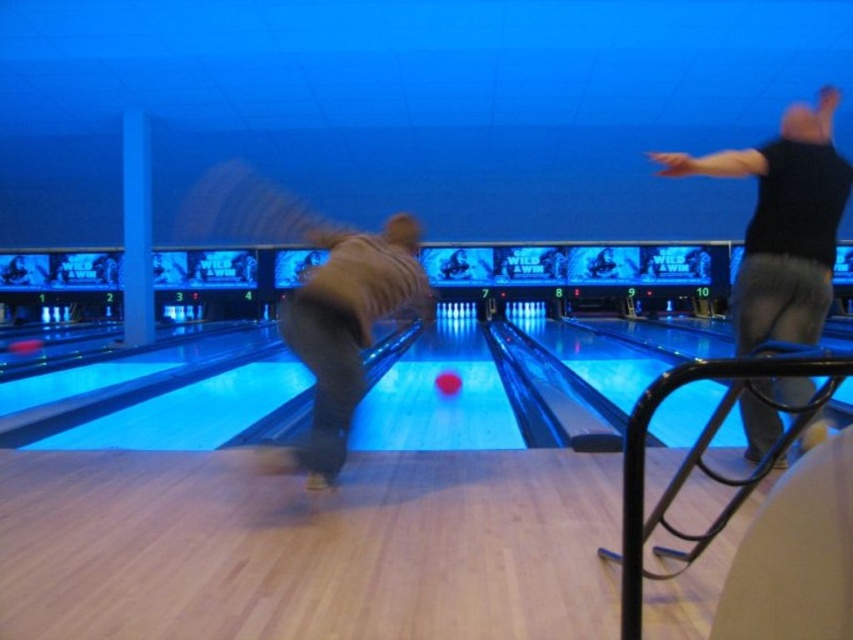
Question: Which object appears farthest from the camera in this image?

Choices:
 (A) shiny red bowling ball at center
 (B) black matte shirt at upper right
 (C) brown suede jacket at center

Answer: (A)

Question: Can you confirm if brown suede jacket at center is thinner than shiny red bowling ball at center?

Choices:
 (A) no
 (B) yes

Answer: (A)

Question: Which of the following is the closest to the observer?

Choices:
 (A) (784, 218)
 (B) (331, 376)

Answer: (B)

Question: Does black matte shirt at upper right appear on the left side of shiny red bowling ball at center?

Choices:
 (A) no
 (B) yes

Answer: (A)

Question: Is the position of brown suede jacket at center less distant than that of shiny red bowling ball at center?

Choices:
 (A) yes
 (B) no

Answer: (A)

Question: Which object appears farthest from the camera in this image?

Choices:
 (A) shiny red bowling ball at center
 (B) brown suede jacket at center
 (C) black matte shirt at upper right

Answer: (A)